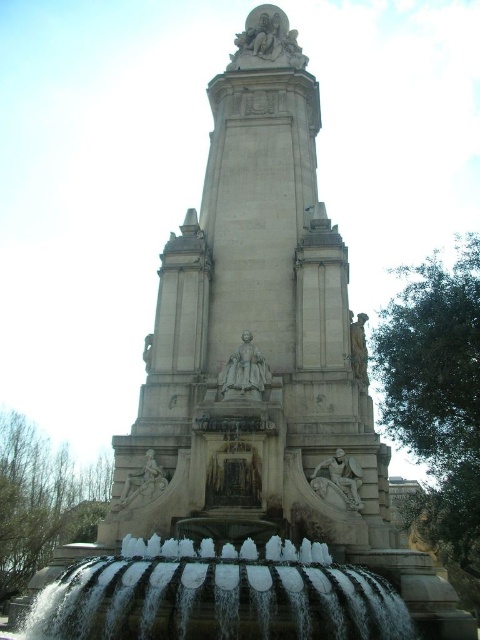
Question: Is white frothy water at center to the right of polished stone sculpture at upper center from the viewer's perspective?

Choices:
 (A) no
 (B) yes

Answer: (A)

Question: Can you confirm if white frothy water at center is positioned to the left of polished stone sculpture at upper center?

Choices:
 (A) no
 (B) yes

Answer: (B)

Question: Is white frothy water at center positioned before white marble statue at lower center?

Choices:
 (A) no
 (B) yes

Answer: (B)

Question: Based on their relative distances, which object is nearer to the white marble relief at center?

Choices:
 (A) polished stone sculpture at upper center
 (B) gray stone statue at center
 (C) white frothy water at center
 (D) white marble statue at lower center

Answer: (C)

Question: Which point is farther to the camera?

Choices:
 (A) (124, 497)
 (B) (92, 612)

Answer: (A)

Question: Which point is closer to the camera?

Choices:
 (A) white marble statue at lower center
 (B) white frothy water at center
 (C) white marble relief at center

Answer: (B)